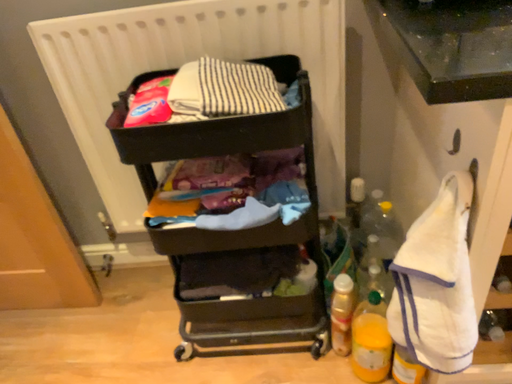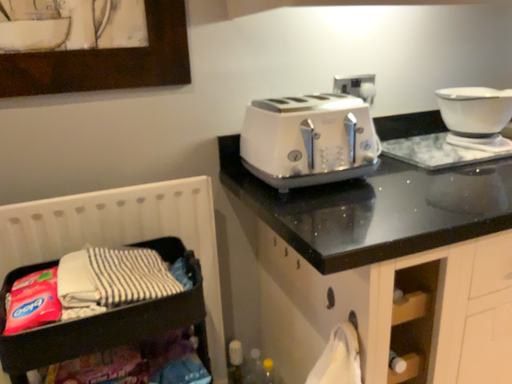
Question: Which way did the camera rotate in the video?

Choices:
 (A) rotated downward
 (B) rotated upward

Answer: (B)